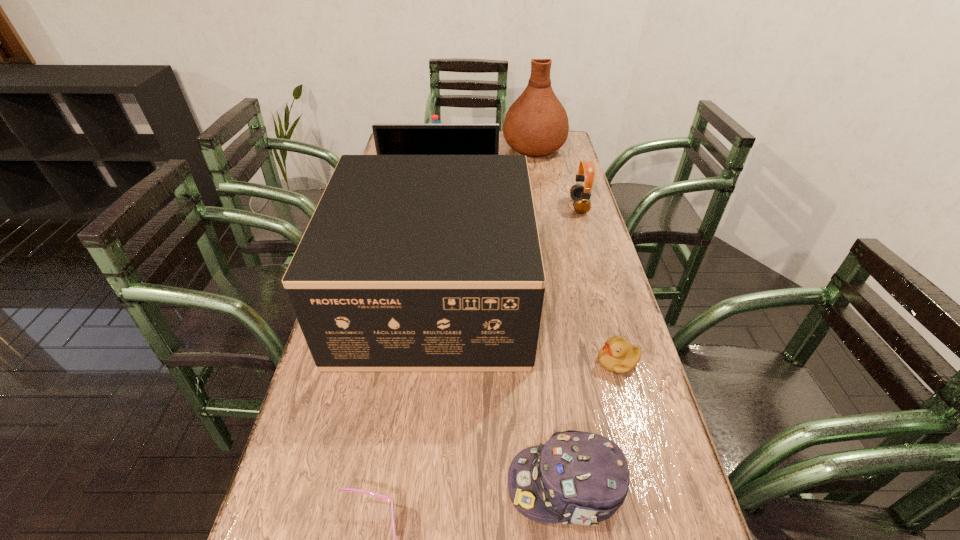
I want to click on unoccupied position between the pitcher and the fourth shortest object, so click(x=556, y=177).

Locate an element on the screen. free space between the box and the sixth tallest object is located at coordinates (500, 390).

Find the location of a particular element. vacant space that is in between the pitcher and the third shortest object is located at coordinates (550, 316).

This screenshot has height=540, width=960. Find the location of `unoccupied position between the pitcher and the headwear`. unoccupied position between the pitcher and the headwear is located at coordinates (550, 316).

Locate an element on the screen. free space between the headwear and the tallest object is located at coordinates (550, 316).

Where is `empty space between the box and the headwear`? The image size is (960, 540). empty space between the box and the headwear is located at coordinates (500, 390).

Identify which object is the second closest to the water bottle. Please provide its 2D coordinates. Your answer should be formatted as a tuple, i.e. [(x, y)], where the tuple contains the x and y coordinates of a point satisfying the conditions above.

[(536, 124)]

Choose which object is the fourth nearest neighbor to the water bottle. Please provide its 2D coordinates. Your answer should be formatted as a tuple, i.e. [(x, y)], where the tuple contains the x and y coordinates of a point satisfying the conditions above.

[(580, 194)]